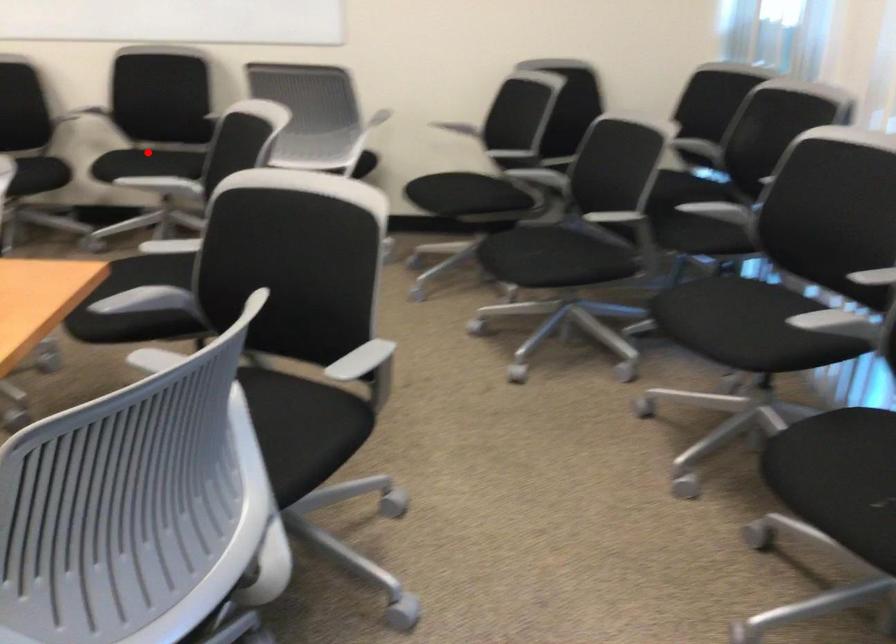
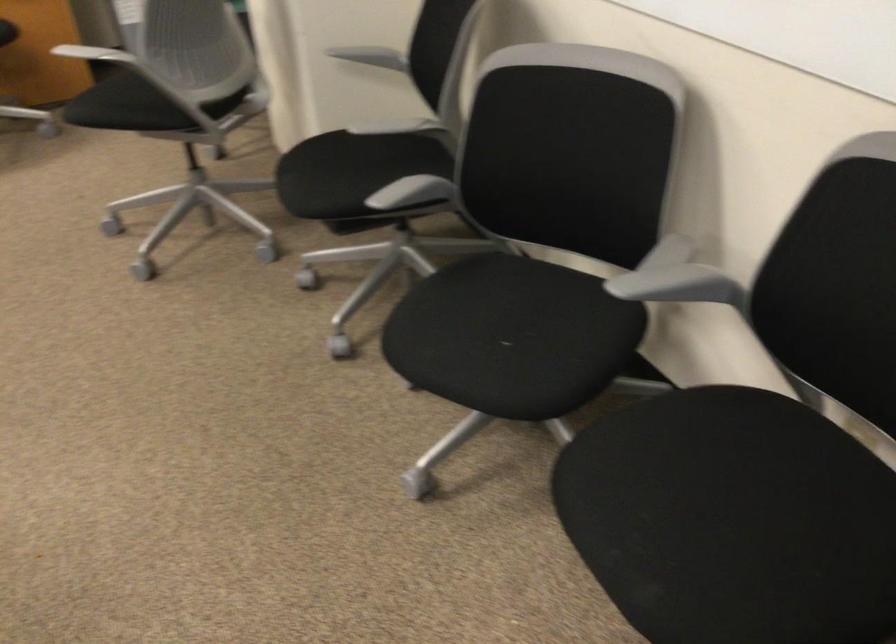
Find the pixel in the second image that matches the highlighted location in the first image.

(711, 458)